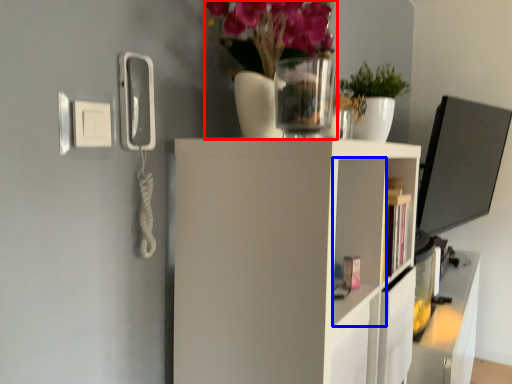
Question: Among these objects, which one is nearest to the camera, floral arrangement (highlighted by a red box) or cabinet (highlighted by a blue box)?

Choices:
 (A) floral arrangement
 (B) cabinet

Answer: (A)